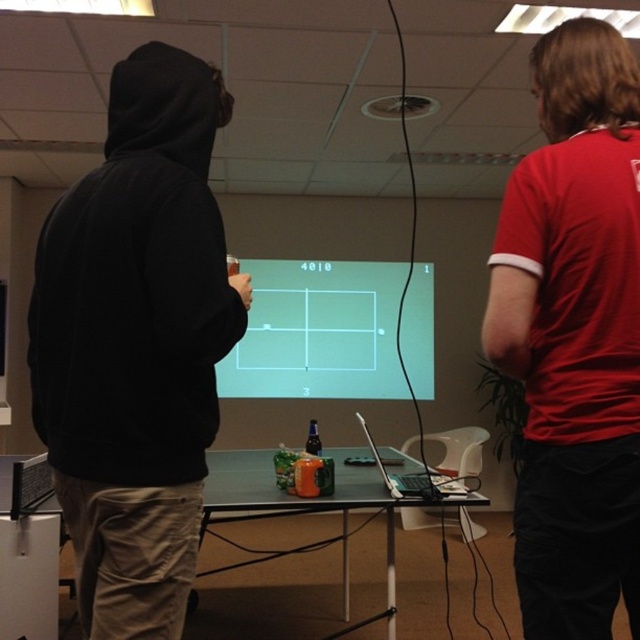
Question: Does green plastic table at center appear on the left side of silver metallic laptop at center?

Choices:
 (A) yes
 (B) no

Answer: (A)

Question: Does red cotton shirt at right appear over silver metallic laptop at center?

Choices:
 (A) yes
 (B) no

Answer: (A)

Question: Which point is closer to the camera?

Choices:
 (A) (536, 413)
 (B) (400, 292)
 (C) (426, 481)

Answer: (A)

Question: Which of the following is the farthest from the observer?

Choices:
 (A) red cotton shirt at right
 (B) green matte projection screen at center
 (C) silver metallic laptop at center

Answer: (B)

Question: Which of the following is the farthest from the observer?

Choices:
 (A) [356, 490]
 (B) [529, 324]
 (C) [365, 436]
 (D) [312, 262]

Answer: (D)

Question: Is red cotton shirt at right below green plastic table at center?

Choices:
 (A) yes
 (B) no

Answer: (B)